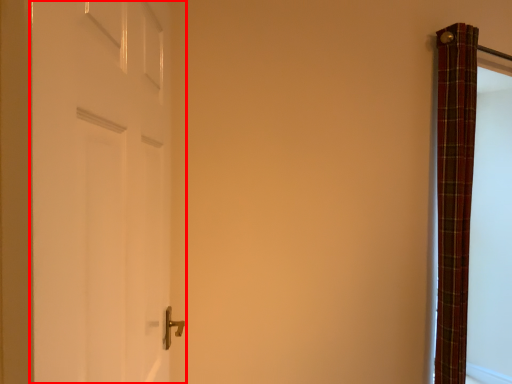
Question: Observing the image, what is the correct spatial positioning of door (annotated by the red box) in reference to curtain?

Choices:
 (A) right
 (B) left

Answer: (B)